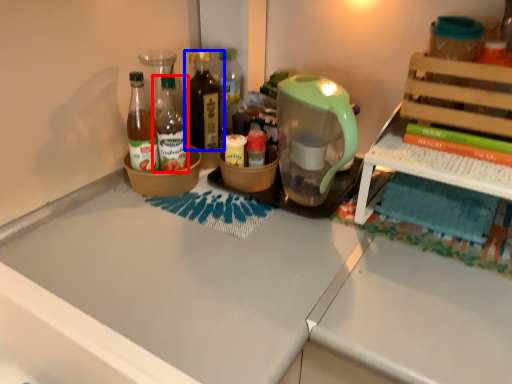
Question: Which object appears farthest to the camera in this image, bottle (highlighted by a red box) or bottle (highlighted by a blue box)?

Choices:
 (A) bottle
 (B) bottle

Answer: (B)